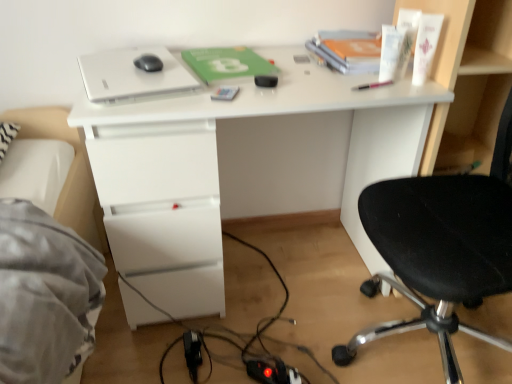
This screenshot has height=384, width=512. I want to click on free spot in front of white matte book at upper right, so click(x=358, y=83).